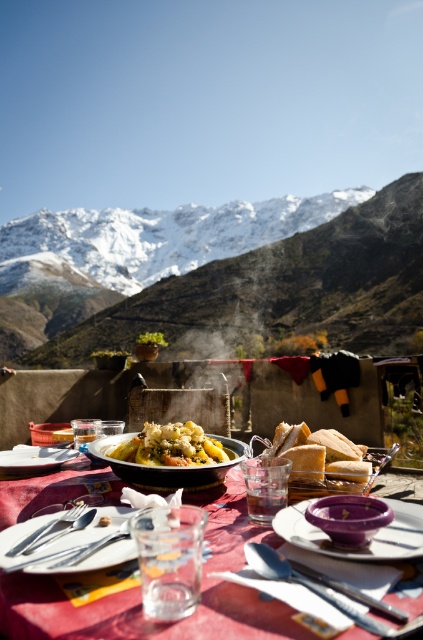
You are a guest at this outdoor dining table. You want to pick up the shiny silver fork at lower left to eat the golden brown pasta at center. Can you reach it without moving your seat?

The golden brown pasta at center is 9.41 inches away from the shiny silver fork at lower left. Since the distance is relatively short, you can likely reach the shiny silver fork at lower left to eat the golden brown pasta at center without moving your seat.